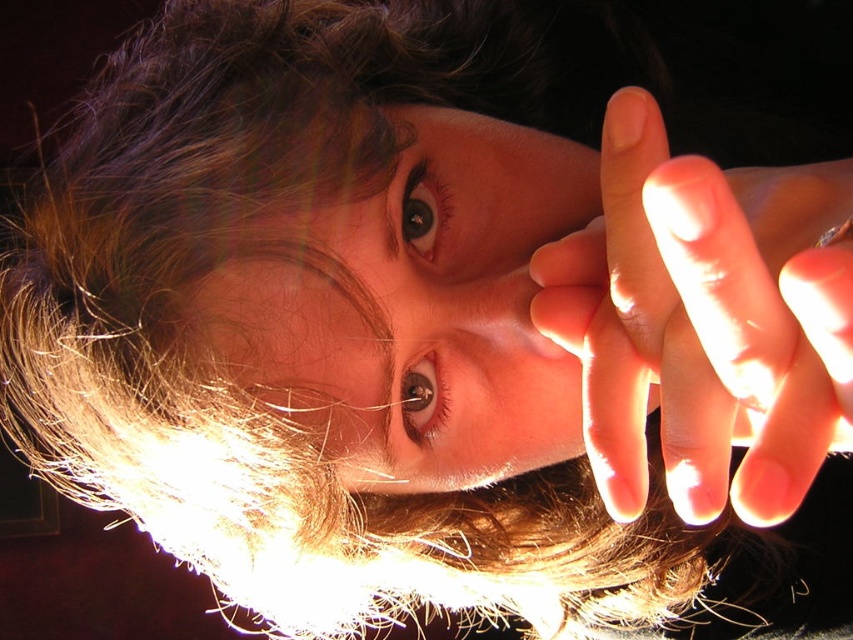
This screenshot has height=640, width=853. What do you see at coordinates (413, 308) in the screenshot?
I see `matte skin face at center` at bounding box center [413, 308].

Identify the location of matte skin face at center. The image size is (853, 640). (413, 308).